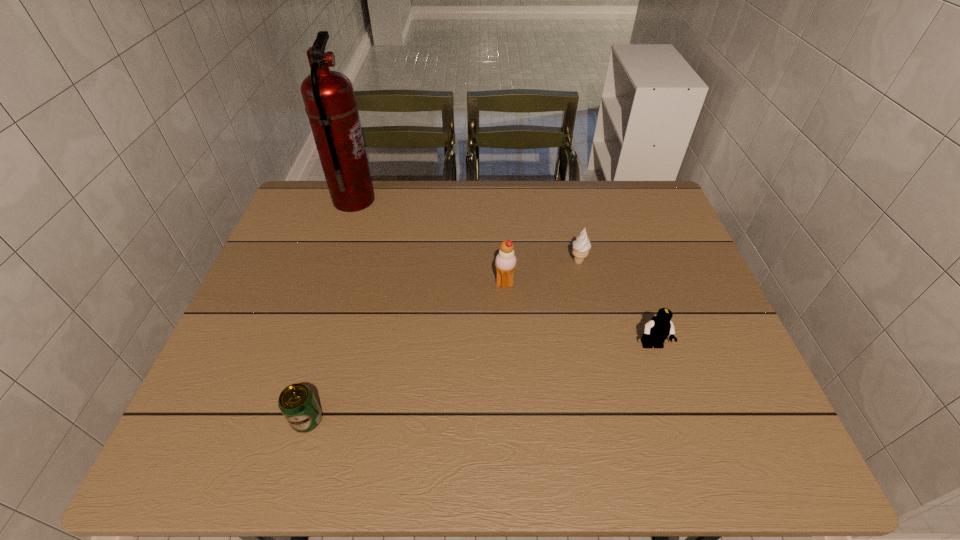
Find the location of a particular element. vacant position in the image that satisfies the following two spatial constraints: 1. at the front with a straw on the third nearest object; 2. on the front side of the shortest object is located at coordinates (512, 420).

The width and height of the screenshot is (960, 540). I want to click on vacant position in the image that satisfies the following two spatial constraints: 1. on the nozzle side of the beer can; 2. on the left side of the farthest object, so click(281, 420).